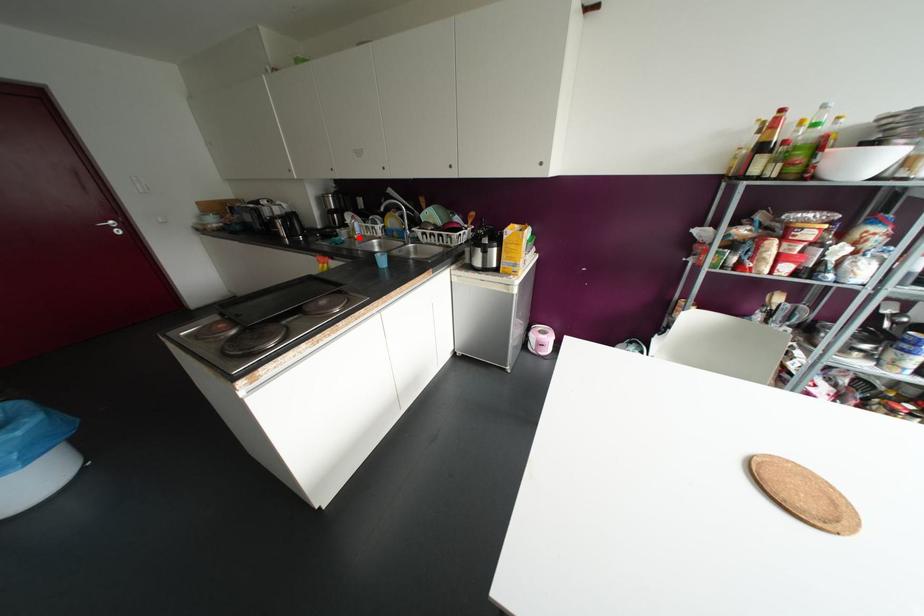
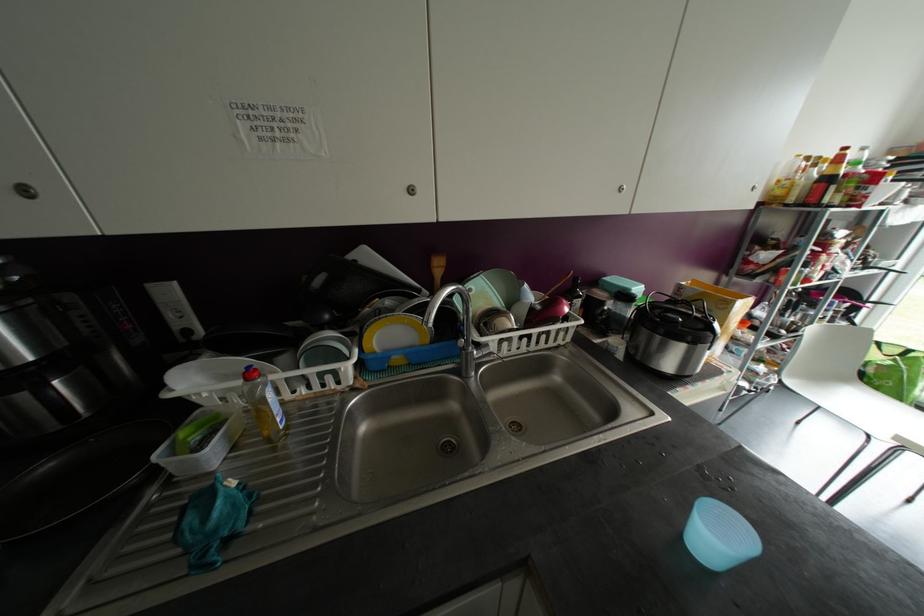
The point at the highlighted location is marked in the first image. Where is the corresponding point in the second image?

(286, 427)